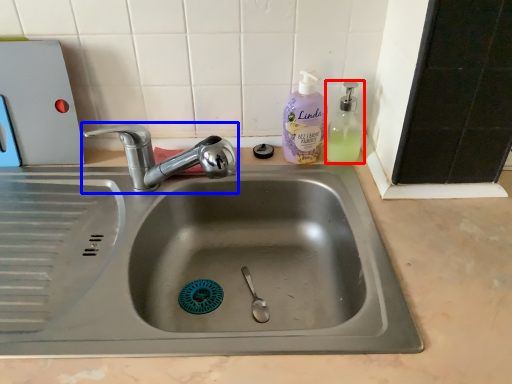
Question: Which object is further to the camera taking this photo, soap dispenser (highlighted by a red box) or tap (highlighted by a blue box)?

Choices:
 (A) soap dispenser
 (B) tap

Answer: (A)